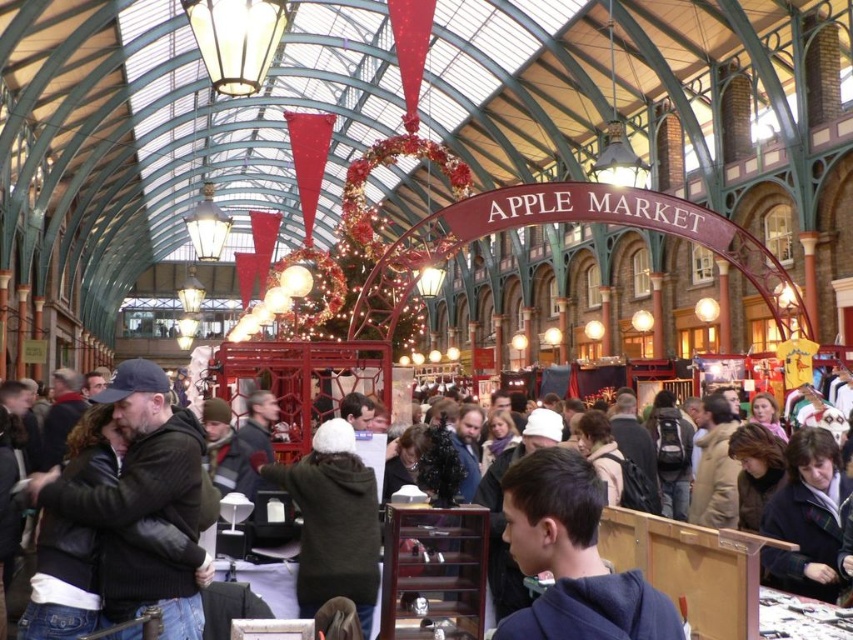
You are standing in the Apple Market and see a dark blue hoodie at center and a dark brown leather jacket at center. Which clothing item is nearer to you?

The dark blue hoodie at center is closer to the viewer than the dark brown leather jacket at center, so the dark blue hoodie at center is nearer to you.

You are standing in the Apple Market and want to reach the exit located at point (730,579). There is an obstacle at point (573,524). Can you go around the obstacle to reach the exit?

Point (573,524) is in front of point (730,579), so you can go around the obstacle at point (573,524) to reach the exit at point (730,579).

You are standing in the Apple Market and want to take a photo of both the point at location (120, 531) and the point at (543, 500). Which point should you focus on first to ensure both are in focus?

You should focus on the point at (120, 531) first because it is closer to the camera than the point at (543, 500). By focusing on the closer point, the farther point will also be within the depth of field, ensuring both are in focus.